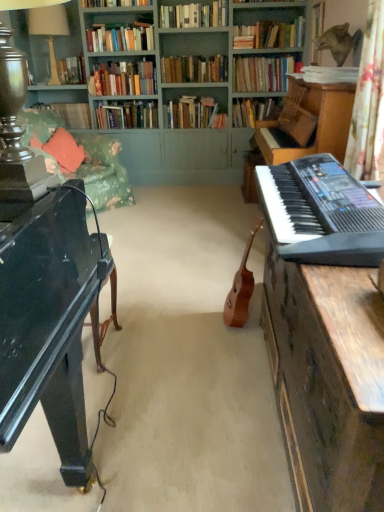
Question: Is wooden piano at right inside hardcover books at upper center, acting as the 4th book starting from the front?

Choices:
 (A) yes
 (B) no

Answer: (B)

Question: Is hardcover books at upper center, acting as the 4th book starting from the front, taller than wooden piano at right?

Choices:
 (A) no
 (B) yes

Answer: (A)

Question: Does hardcover books at upper center, acting as the 4th book starting from the front, have a lesser height compared to wooden piano at right?

Choices:
 (A) yes
 (B) no

Answer: (A)

Question: Does hardcover books at upper center, the 8th book in the back-to-front sequence, have a larger size compared to wooden piano at right?

Choices:
 (A) yes
 (B) no

Answer: (B)

Question: From a real-world perspective, is hardcover books at upper center, acting as the 4th book starting from the front, physically above wooden piano at right?

Choices:
 (A) yes
 (B) no

Answer: (A)

Question: Could you tell me if hardcover books at upper center, acting as the 4th book starting from the front, is facing wooden piano at right?

Choices:
 (A) no
 (B) yes

Answer: (A)

Question: From the image's perspective, would you say wooden piano at right is shown under light brown wood guitar at center?

Choices:
 (A) yes
 (B) no

Answer: (A)

Question: From a real-world perspective, is wooden piano at right below light brown wood guitar at center?

Choices:
 (A) no
 (B) yes

Answer: (A)

Question: Does wooden piano at right have a lesser width compared to light brown wood guitar at center?

Choices:
 (A) yes
 (B) no

Answer: (B)

Question: Does wooden piano at right have a lesser height compared to light brown wood guitar at center?

Choices:
 (A) no
 (B) yes

Answer: (A)

Question: Is wooden piano at right closer to camera compared to light brown wood guitar at center?

Choices:
 (A) no
 (B) yes

Answer: (B)

Question: Can you confirm if wooden piano at right is wider than light brown wood guitar at center?

Choices:
 (A) yes
 (B) no

Answer: (A)

Question: From the image's perspective, is light brown wood guitar at center above hardcover books at upper center, which is the 6th book from back to front?

Choices:
 (A) no
 (B) yes

Answer: (A)